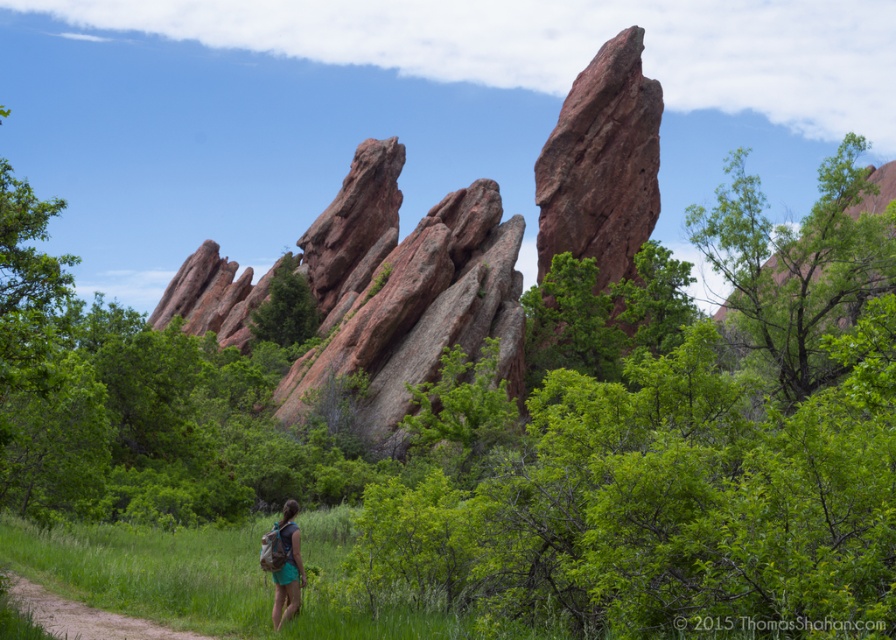
Question: Is reddish-brown rock formation at center above reddish-brown rock at center?

Choices:
 (A) no
 (B) yes

Answer: (B)

Question: Does reddish-brown rock formation at center have a larger size compared to matte green backpack at center?

Choices:
 (A) yes
 (B) no

Answer: (A)

Question: Based on their relative distances, which object is farther from the reddish-brown rock at center?

Choices:
 (A) brown dirt path at lower left
 (B) matte green backpack at center

Answer: (B)

Question: Does brown dirt path at lower left have a smaller size compared to matte green backpack at center?

Choices:
 (A) yes
 (B) no

Answer: (B)

Question: Which point is closer to the camera?

Choices:
 (A) (302, 580)
 (B) (168, 636)
 (C) (231, 282)
 (D) (570, 232)

Answer: (B)

Question: Which object appears closest to the camera in this image?

Choices:
 (A) reddish-brown rock at center
 (B) brown dirt path at lower left
 (C) matte green backpack at center

Answer: (C)